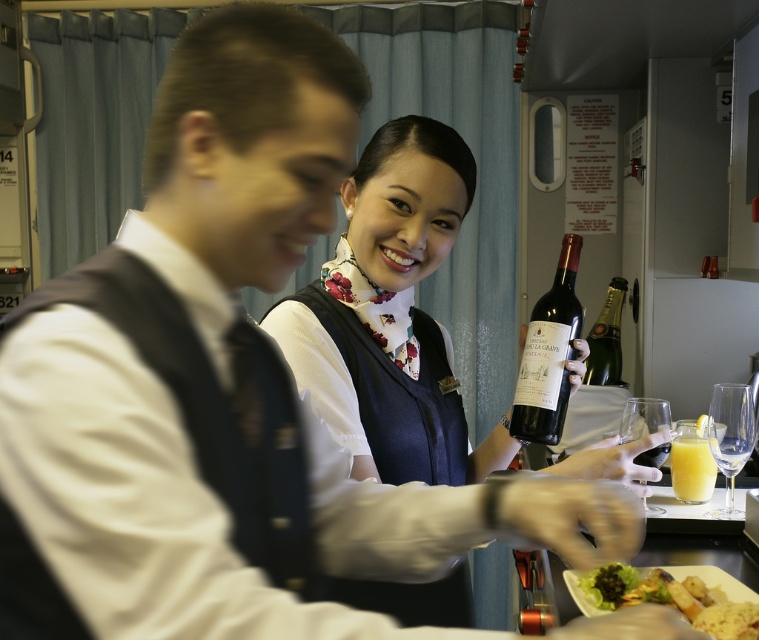
Question: Is matte glass bottle at center to the right of transparent glass at lower right from the viewer's perspective?

Choices:
 (A) no
 (B) yes

Answer: (A)

Question: Which point is farther to the camera?

Choices:
 (A) translucent glass at lower right
 (B) clear glass wine glass at lower right

Answer: (A)

Question: Considering the relative positions of clear glass wine glass at lower right and translucent glass at lower right in the image provided, where is clear glass wine glass at lower right located with respect to translucent glass at lower right?

Choices:
 (A) above
 (B) below

Answer: (A)

Question: Which of these objects is positioned closest to the matte blue vest at center?

Choices:
 (A) matte glass champagne bottle at right
 (B) green leafy salad at lower center

Answer: (B)

Question: Estimate the real-world distances between objects in this image. Which object is farther from the clear glass wine glass at lower right?

Choices:
 (A) transparent glass at lower right
 (B) matte blue vest at center
 (C) green leafy salad at lower center

Answer: (B)

Question: Can you confirm if matte glass bottle at center is positioned below transparent glass at lower right?

Choices:
 (A) yes
 (B) no

Answer: (B)